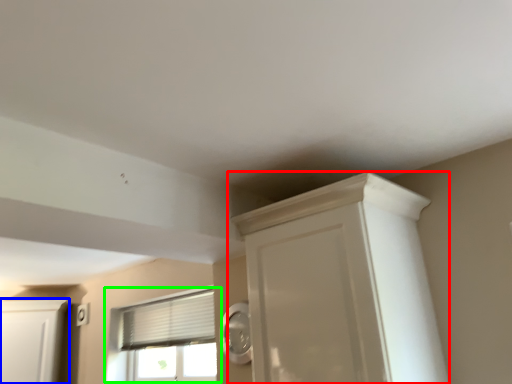
Question: Estimate the real-world distances between objects in this image. Which object is farther from cupboard (highlighted by a red box), cabinetry (highlighted by a blue box) or window (highlighted by a green box)?

Choices:
 (A) cabinetry
 (B) window

Answer: (A)